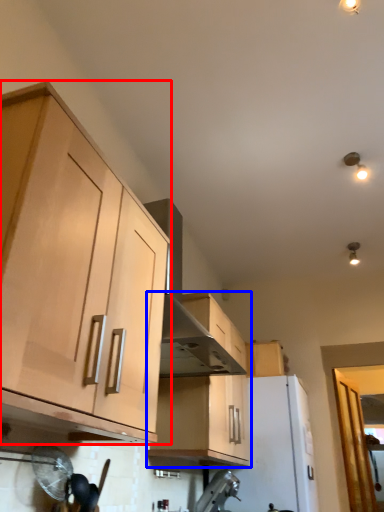
Question: Which object is closer to the camera taking this photo, cabinetry (highlighted by a red box) or cabinetry (highlighted by a blue box)?

Choices:
 (A) cabinetry
 (B) cabinetry

Answer: (A)